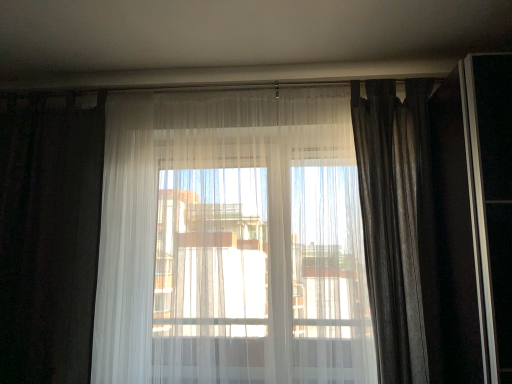
Question: From a real-world perspective, is silky gray curtain at right, which is the first curtain in right-to-left order, positioned above or below white sheer curtain at left, the first curtain positioned from the left?

Choices:
 (A) above
 (B) below

Answer: (A)

Question: Is silky gray curtain at right, the 3th curtain in the left-to-right sequence, to the left or to the right of white sheer curtain at left, the 3th curtain positioned from the right, in the image?

Choices:
 (A) left
 (B) right

Answer: (B)

Question: Which is nearer to the silky gray curtain at right, which is the first curtain in right-to-left order?

Choices:
 (A) sheer white curtain at center, the 2th curtain from the left
 (B) white sheer curtain at left, the first curtain positioned from the left

Answer: (A)

Question: Based on their relative distances, which object is farther from the silky gray curtain at right, the 3th curtain in the left-to-right sequence?

Choices:
 (A) white sheer curtain at left, the 3th curtain positioned from the right
 (B) sheer white curtain at center, which ranks as the 2th curtain in right-to-left order

Answer: (A)